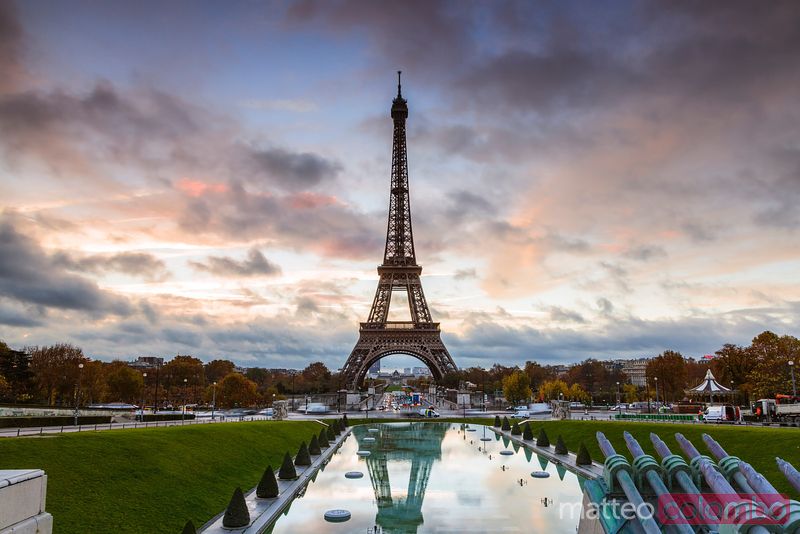
You are a GUI agent. You are given a task and a screenshot of the screen. Output one action in this format:
    pyautogui.click(x=<x>, y=<y>)
    Task: Click on the decorative medal object (partially in picture)
    The image size is (800, 534).
    Given the screenshot: What is the action you would take?
    pyautogui.click(x=688, y=484)